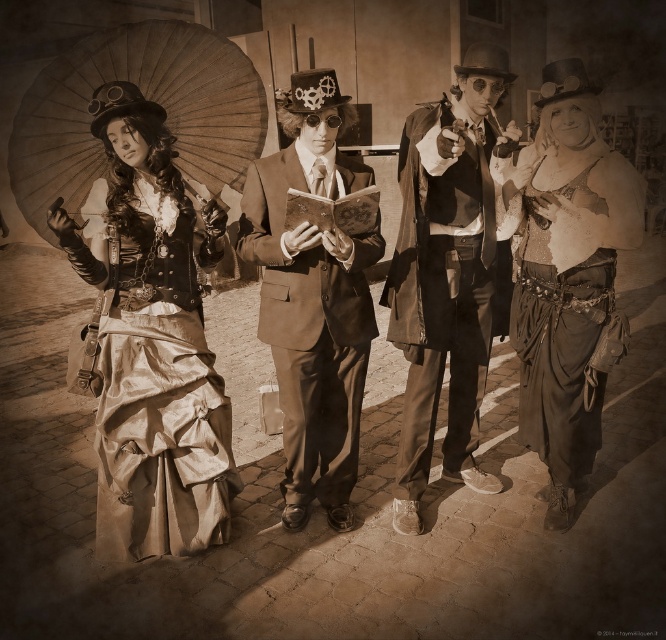
Does shiny silver corset at center appear on the right side of matte brown coat at center?

Yes, shiny silver corset at center is to the right of matte brown coat at center.

Who is positioned more to the left, shiny silver corset at center or matte brown coat at center?

matte brown coat at center is more to the left.

What do you see at coordinates (567, 278) in the screenshot? The width and height of the screenshot is (666, 640). I see `shiny silver corset at center` at bounding box center [567, 278].

Where is `shiny silver corset at center`? shiny silver corset at center is located at coordinates click(567, 278).

Is shiny silver corset at center thinner than matte paper umbrella at left?

Indeed, shiny silver corset at center has a lesser width compared to matte paper umbrella at left.

What do you see at coordinates (567, 278) in the screenshot? This screenshot has width=666, height=640. I see `shiny silver corset at center` at bounding box center [567, 278].

Does point (579, 420) come behind point (248, 131)?

That is False.

Where is `shiny silver corset at center`? This screenshot has width=666, height=640. shiny silver corset at center is located at coordinates (567, 278).

Can you confirm if shiny gold skirt at left is shorter than matte brown coat at center?

Yes.

Which is more to the left, shiny gold skirt at left or matte brown coat at center?

Positioned to the left is shiny gold skirt at left.

The width and height of the screenshot is (666, 640). I want to click on shiny gold skirt at left, so click(x=151, y=340).